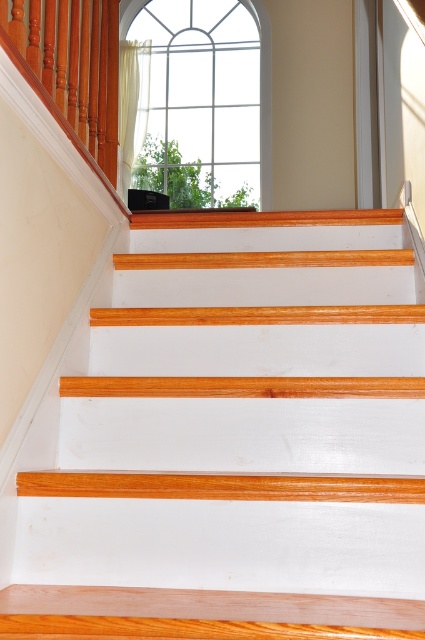
You are a delivery person carrying a package that is 1 meter wide. You need to navigate through the space between the white painted wood stair at center and the polished wood handrail at upper left. Can your package fit through that space?

The distance between the white painted wood stair at center and the polished wood handrail at upper left is 1.10 meters. Since the package is 1 meter wide, it should fit through the space as the available width is slightly larger than the package.

You are a delivery person carrying a package that is 3.8 meters long. You need to navigate through the space between the white painted wood stair at center and the clear glass window at upper center. Will the package fit through this space?

The distance between the white painted wood stair at center and the clear glass window at upper center is 3.77 meters. Since the package is 3.8 meters long, it is slightly longer than the available space. The package will not fit through the space between them.

Consider the image. You are standing at the bottom of the staircase and want to reach the landing area. There are two points marked on the stairs. Which point, point [175,438] or point [206,92], is closer to the landing area?

Point [175,438] is closer to the landing area because it is in front of point [206,92].